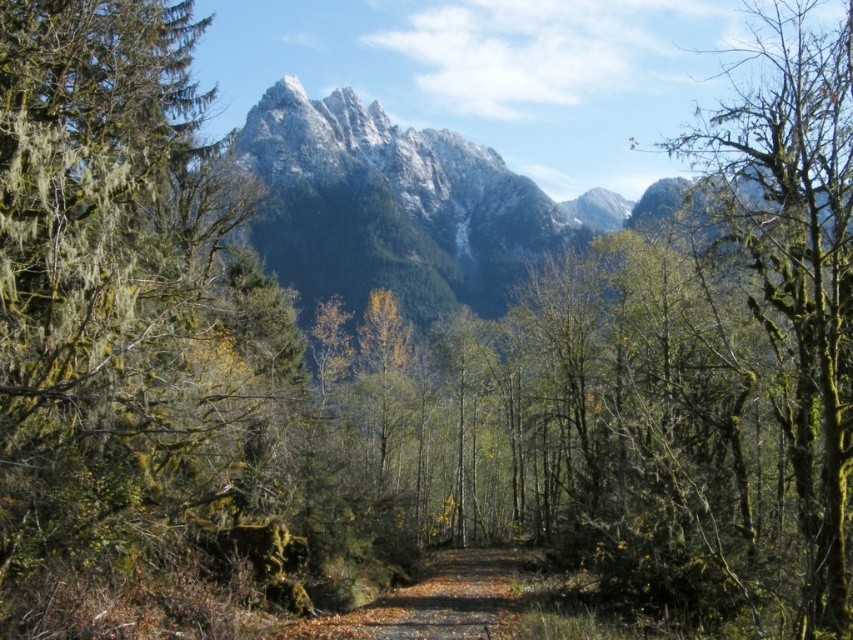
Question: In this image, where is green mossy tree at left located relative to brown wooden path at center?

Choices:
 (A) above
 (B) below

Answer: (A)

Question: Can you confirm if green mossy tree at left is positioned to the right of snowy granite mountain at upper center?

Choices:
 (A) no
 (B) yes

Answer: (A)

Question: Can you confirm if green mossy tree at left is positioned below green mossy tree at right?

Choices:
 (A) no
 (B) yes

Answer: (B)

Question: Which point is closer to the camera taking this photo?

Choices:
 (A) (813, 97)
 (B) (367, 625)
 (C) (518, 221)

Answer: (B)

Question: Which point is closer to the camera?

Choices:
 (A) (128, 58)
 (B) (538, 221)
 (C) (821, 378)
 (D) (450, 595)

Answer: (C)

Question: Which of the following is the closest to the observer?

Choices:
 (A) (71, 352)
 (B) (821, 362)
 (C) (424, 608)

Answer: (A)